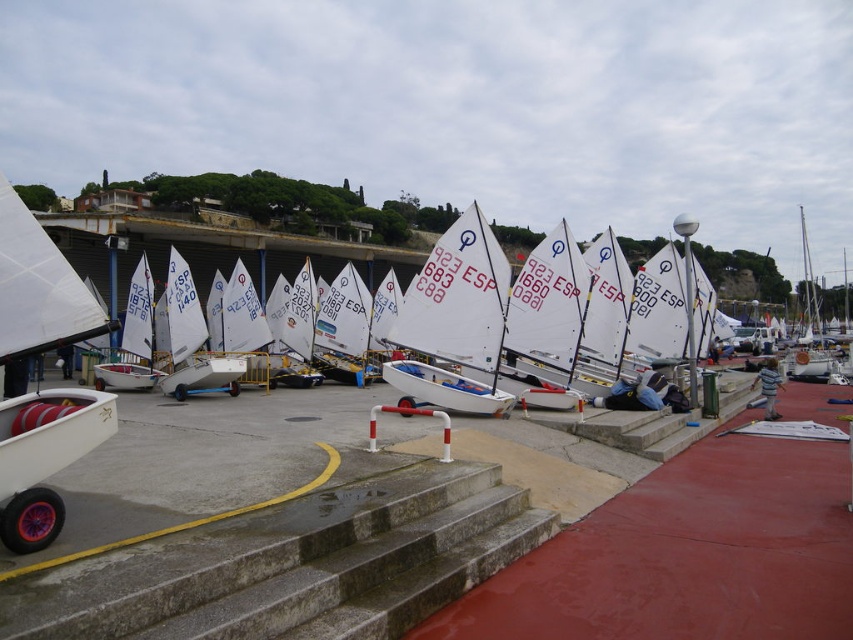
Question: Is concrete steps at center closer to camera compared to white matte sailboat at left?

Choices:
 (A) yes
 (B) no

Answer: (A)

Question: Which is nearer to the white matte sailboat at left?

Choices:
 (A) white plastic sailboat at center
 (B) rubber wheel at lower left
 (C) concrete steps at center
 (D) white matte sailboat at center

Answer: (B)

Question: Which point appears closest to the camera in this image?

Choices:
 (A) (461, 380)
 (B) (300, 493)
 (C) (15, 216)

Answer: (C)

Question: Is white matte sailboat at left in front of white plastic sailboat at center?

Choices:
 (A) yes
 (B) no

Answer: (A)

Question: Which is nearer to the white matte sailboat at center?

Choices:
 (A) concrete steps at center
 (B) rubber wheel at lower left

Answer: (A)

Question: Is concrete steps at center below white matte sailboat at center?

Choices:
 (A) yes
 (B) no

Answer: (A)